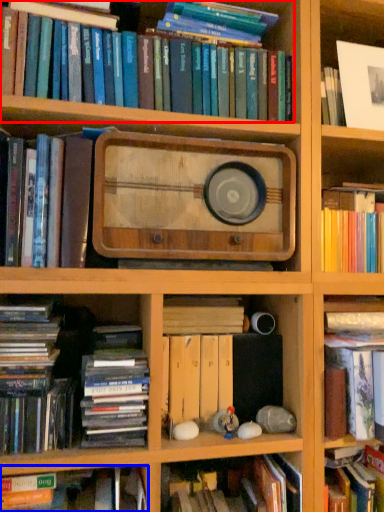
Question: Which of the following is the closest to the observer, book (highlighted by a red box) or book (highlighted by a blue box)?

Choices:
 (A) book
 (B) book

Answer: (B)